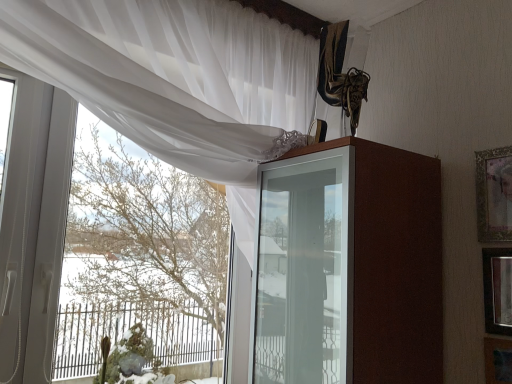
Question: Is wooden picture frame at lower right, the 3th picture frame positioned from the top, smaller than gold-framed picture at upper right, which is counted as the third picture frame, starting from the bottom?

Choices:
 (A) yes
 (B) no

Answer: (A)

Question: Is the surface of wooden picture frame at lower right, arranged as the 1th picture frame when ordered from the bottom, in direct contact with gold-framed picture at upper right, arranged as the 1th picture frame when viewed from the top?

Choices:
 (A) yes
 (B) no

Answer: (B)

Question: From the image's perspective, is wooden picture frame at lower right, arranged as the 1th picture frame when ordered from the bottom, below gold-framed picture at upper right, which is counted as the third picture frame, starting from the bottom?

Choices:
 (A) no
 (B) yes

Answer: (B)

Question: Is wooden picture frame at lower right, arranged as the 1th picture frame when ordered from the bottom, oriented away from gold-framed picture at upper right, arranged as the 1th picture frame when viewed from the top?

Choices:
 (A) yes
 (B) no

Answer: (B)

Question: Would you say gold-framed picture at upper right, which is counted as the third picture frame, starting from the bottom, is part of wooden picture frame at lower right, the 3th picture frame positioned from the top,'s contents?

Choices:
 (A) yes
 (B) no

Answer: (B)

Question: Is wooden picture frame at lower right, arranged as the 1th picture frame when ordered from the bottom, far away from gold-framed picture at upper right, arranged as the 1th picture frame when viewed from the top?

Choices:
 (A) no
 (B) yes

Answer: (A)

Question: Is green mossy plant at lower left closer to the viewer compared to wooden framed mirror at right, the second picture frame positioned from the bottom?

Choices:
 (A) yes
 (B) no

Answer: (B)

Question: From a real-world perspective, is green mossy plant at lower left physically above wooden framed mirror at right, the 2th picture frame viewed from the top?

Choices:
 (A) yes
 (B) no

Answer: (B)

Question: Is green mossy plant at lower left turned away from wooden framed mirror at right, the 2th picture frame viewed from the top?

Choices:
 (A) yes
 (B) no

Answer: (B)

Question: Is wooden framed mirror at right, the 2th picture frame viewed from the top, surrounded by green mossy plant at lower left?

Choices:
 (A) yes
 (B) no

Answer: (B)

Question: From the image's perspective, is green mossy plant at lower left under wooden framed mirror at right, the 2th picture frame viewed from the top?

Choices:
 (A) yes
 (B) no

Answer: (A)

Question: Does green mossy plant at lower left turn towards wooden framed mirror at right, the second picture frame positioned from the bottom?

Choices:
 (A) no
 (B) yes

Answer: (A)

Question: Is brown glossy cabinet at upper center smaller than green mossy plant at lower left?

Choices:
 (A) no
 (B) yes

Answer: (A)